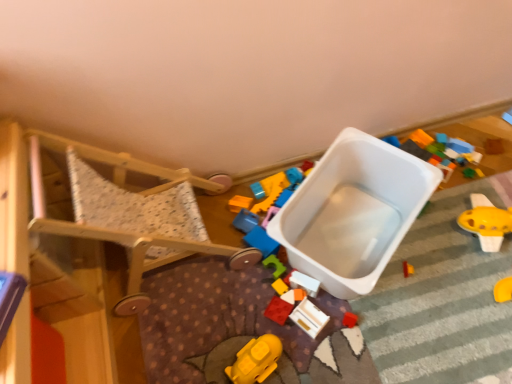
Find the location of a particular element. This screenshot has height=384, width=512. unoccupied region to the right of wooden walker at left is located at coordinates pyautogui.click(x=264, y=230).